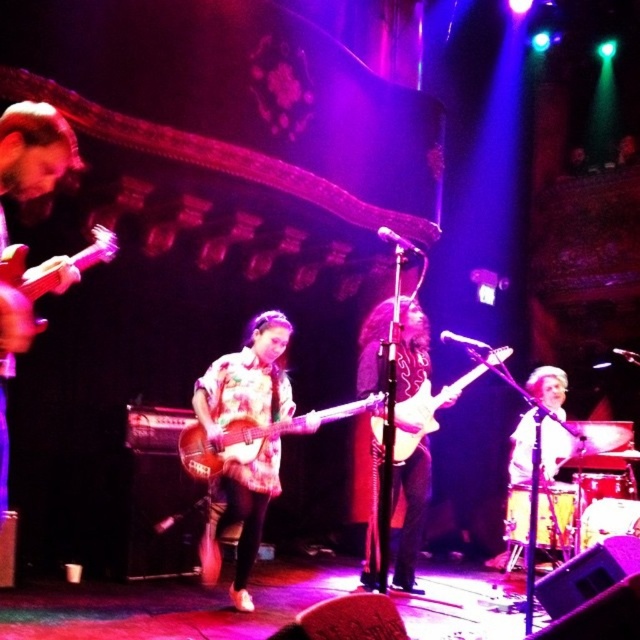
Can you confirm if tie-dye wood guitar at center is thinner than light brown drum set at lower right?

Incorrect, tie-dye wood guitar at center's width is not less than light brown drum set at lower right's.

Does tie-dye wood guitar at center have a larger size compared to light brown drum set at lower right?

No, tie-dye wood guitar at center is not bigger than light brown drum set at lower right.

You are a GUI agent. You are given a task and a screenshot of the screen. Output one action in this format:
    pyautogui.click(x=<x>, y=<y>)
    Task: Click on the tie-dye wood guitar at center
    
    Given the screenshot: What is the action you would take?
    pyautogui.click(x=228, y=444)

Is point (316, 416) closer to camera compared to point (540, 470)?

Yes, point (316, 416) is in front of point (540, 470).

Does floral shirt at center have a lesser width compared to light brown drum set at lower right?

Incorrect, floral shirt at center's width is not less than light brown drum set at lower right's.

Is point (259, 499) positioned before point (518, 428)?

Yes.

The image size is (640, 640). I want to click on floral shirt at center, so click(x=248, y=378).

Between light brown drum set at lower right and matte brown acoustic guitar at left, which one appears on the left side from the viewer's perspective?

From the viewer's perspective, matte brown acoustic guitar at left appears more on the left side.

Which is in front, point (560, 376) or point (12, 257)?

Point (12, 257)

This screenshot has width=640, height=640. I want to click on light brown drum set at lower right, so [522, 451].